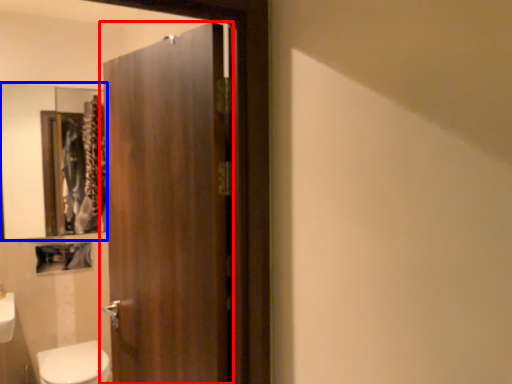
Question: Which object appears closest to the camera in this image, door (highlighted by a red box) or mirror (highlighted by a blue box)?

Choices:
 (A) door
 (B) mirror

Answer: (A)